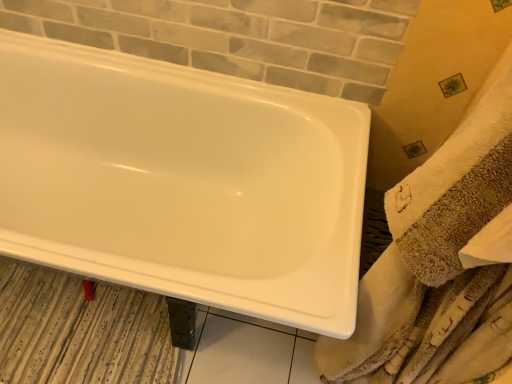
Where is `white glossy bathtub at upper left`? white glossy bathtub at upper left is located at coordinates (182, 182).

Locate an element on the screen. The height and width of the screenshot is (384, 512). beige textured towel at right is located at coordinates (441, 263).

Where is `white glossy bathtub at upper left`? This screenshot has height=384, width=512. white glossy bathtub at upper left is located at coordinates (182, 182).

Which is behind, beige textured towel at right or striped fabric bath mat at lower left?

striped fabric bath mat at lower left.

In the scene shown: Is beige textured towel at right wider or thinner than striped fabric bath mat at lower left?

Clearly, beige textured towel at right has less width compared to striped fabric bath mat at lower left.

Is beige textured towel at right bigger or smaller than striped fabric bath mat at lower left?

Considering their sizes, beige textured towel at right takes up more space than striped fabric bath mat at lower left.

What's the angular difference between white glossy bathtub at upper left and beige textured towel at right's facing directions?

white glossy bathtub at upper left and beige textured towel at right are facing 180 degrees away from each other.

Does white glossy bathtub at upper left appear on the left side of beige textured towel at right?

Yes.

Can you confirm if white glossy bathtub at upper left is smaller than beige textured towel at right?

Actually, white glossy bathtub at upper left might be larger than beige textured towel at right.

Which object is thinner, white glossy bathtub at upper left or beige textured towel at right?

beige textured towel at right.

Is beige textured towel at right closer to camera compared to white glossy bathtub at upper left?

Yes, beige textured towel at right is closer to the camera.

Does beige textured towel at right have a smaller size compared to white glossy bathtub at upper left?

Correct, beige textured towel at right occupies less space than white glossy bathtub at upper left.

From the image's perspective, is beige textured towel at right under white glossy bathtub at upper left?

Indeed, from the image's perspective, beige textured towel at right is shown beneath white glossy bathtub at upper left.

Is there a large distance between beige textured towel at right and white glossy bathtub at upper left?

Actually, beige textured towel at right and white glossy bathtub at upper left are a little close together.

Does striped fabric bath mat at lower left have a larger size compared to beige textured towel at right?

Incorrect, striped fabric bath mat at lower left is not larger than beige textured towel at right.

Is beige textured towel at right located within striped fabric bath mat at lower left?

Actually, beige textured towel at right is outside striped fabric bath mat at lower left.

Based on the photo, is striped fabric bath mat at lower left with beige textured towel at right?

No.

Between striped fabric bath mat at lower left and beige textured towel at right, which one is positioned in front?

beige textured towel at right is more forward.

You are a GUI agent. You are given a task and a screenshot of the screen. Output one action in this format:
    pyautogui.click(x=<x>, y=<y>)
    Task: Click on the bath mat below the white glossy bathtub at upper left (from a real-world perspective)
    The image size is (512, 384).
    Given the screenshot: What is the action you would take?
    pyautogui.click(x=80, y=331)

Considering the relative sizes of striped fabric bath mat at lower left and white glossy bathtub at upper left in the image provided, is striped fabric bath mat at lower left wider than white glossy bathtub at upper left?

Incorrect, the width of striped fabric bath mat at lower left does not surpass that of white glossy bathtub at upper left.

Consider the image. Considering the relative sizes of striped fabric bath mat at lower left and white glossy bathtub at upper left in the image provided, is striped fabric bath mat at lower left taller than white glossy bathtub at upper left?

No.

Could you tell me if striped fabric bath mat at lower left is facing white glossy bathtub at upper left?

Yes, striped fabric bath mat at lower left is turned towards white glossy bathtub at upper left.

Between white glossy bathtub at upper left and striped fabric bath mat at lower left, which one appears on the right side from the viewer's perspective?

From the viewer's perspective, white glossy bathtub at upper left appears more on the right side.

Considering the points (113, 150) and (143, 347), which point is behind, point (113, 150) or point (143, 347)?

Positioned behind is point (113, 150).

From the image's perspective, relative to striped fabric bath mat at lower left, is white glossy bathtub at upper left above or below?

white glossy bathtub at upper left is above striped fabric bath mat at lower left.

Looking at the image, does white glossy bathtub at upper left seem bigger or smaller compared to striped fabric bath mat at lower left?

In the image, white glossy bathtub at upper left appears to be larger than striped fabric bath mat at lower left.

This screenshot has height=384, width=512. I want to click on bath towel above the striped fabric bath mat at lower left (from the image's perspective), so click(x=441, y=263).

The width and height of the screenshot is (512, 384). There is a white glossy bathtub at upper left. Find the location of `bath towel above it (from a real-world perspective)`. bath towel above it (from a real-world perspective) is located at coordinates (441, 263).

Which object lies nearer to the anchor point beige textured towel at right, white glossy bathtub at upper left or striped fabric bath mat at lower left?

Based on the image, white glossy bathtub at upper left appears to be nearer to beige textured towel at right.

Which object lies nearer to the anchor point striped fabric bath mat at lower left, beige textured towel at right or white glossy bathtub at upper left?

Among the two, white glossy bathtub at upper left is located nearer to striped fabric bath mat at lower left.

Considering their positions, is white glossy bathtub at upper left positioned closer to striped fabric bath mat at lower left than beige textured towel at right?

white glossy bathtub at upper left is positioned closer to the anchor striped fabric bath mat at lower left.

Consider the image. Considering their positions, is striped fabric bath mat at lower left positioned further to beige textured towel at right than white glossy bathtub at upper left?

striped fabric bath mat at lower left.

Looking at the image, which one is located further to white glossy bathtub at upper left, beige textured towel at right or striped fabric bath mat at lower left?

Among the two, beige textured towel at right is located further to white glossy bathtub at upper left.

Based on their spatial positions, is striped fabric bath mat at lower left or beige textured towel at right further from white glossy bathtub at upper left?

beige textured towel at right lies further to white glossy bathtub at upper left than the other object.

Identify the location of bathtub between striped fabric bath mat at lower left and beige textured towel at right. This screenshot has height=384, width=512. (182, 182).